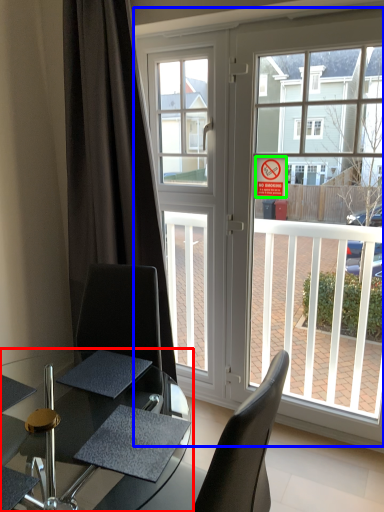
Question: Considering the real-world distances, which object is farthest from table (highlighted by a red box)? window (highlighted by a blue box) or parking sign (highlighted by a green box)?

Choices:
 (A) window
 (B) parking sign

Answer: (B)